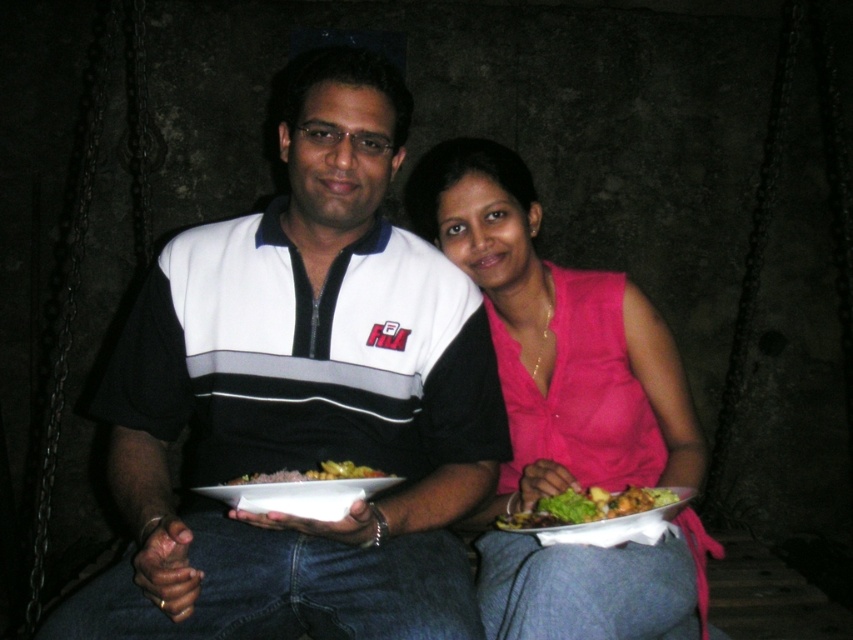
Does pink fabric shirt at center lie behind white glossy plate at center?

Answer: That is True.

Between pink fabric shirt at center and white glossy plate at center, which one appears on the left side from the viewer's perspective?

white glossy plate at center is more to the left.

Describe the element at coordinates (556, 339) in the screenshot. I see `pink fabric shirt at center` at that location.

Image resolution: width=853 pixels, height=640 pixels. I want to click on pink fabric shirt at center, so click(x=556, y=339).

Does white striped polo shirt at center lie in front of white glossy plate at center?

No.

Between point (119, 577) and point (378, 480), which one is positioned behind?

Point (119, 577)

At what (x,y) coordinates should I click in order to perform the action: click on white striped polo shirt at center. Please return your answer as a coordinate pair (x, y). The image size is (853, 640). Looking at the image, I should click on (303, 400).

Between white glossy plate at center and brown matte rice at center, which one appears on the right side from the viewer's perspective?

brown matte rice at center is more to the right.

Is point (339, 509) positioned before point (238, 481)?

That is True.

Is point (257, 484) less distant than point (325, 474)?

Yes, it is in front of point (325, 474).

You are a GUI agent. You are given a task and a screenshot of the screen. Output one action in this format:
    pyautogui.click(x=<x>, y=<y>)
    Task: Click on the white glossy plate at center
    The image size is (853, 640).
    Given the screenshot: What is the action you would take?
    pyautogui.click(x=303, y=490)